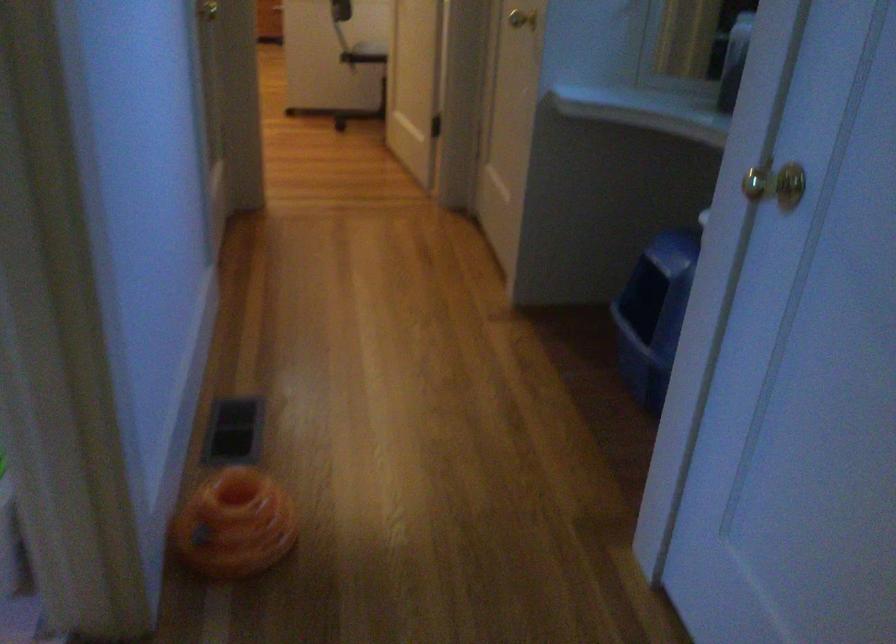
The height and width of the screenshot is (644, 896). Describe the element at coordinates (371, 49) in the screenshot. I see `the chair sitting surface` at that location.